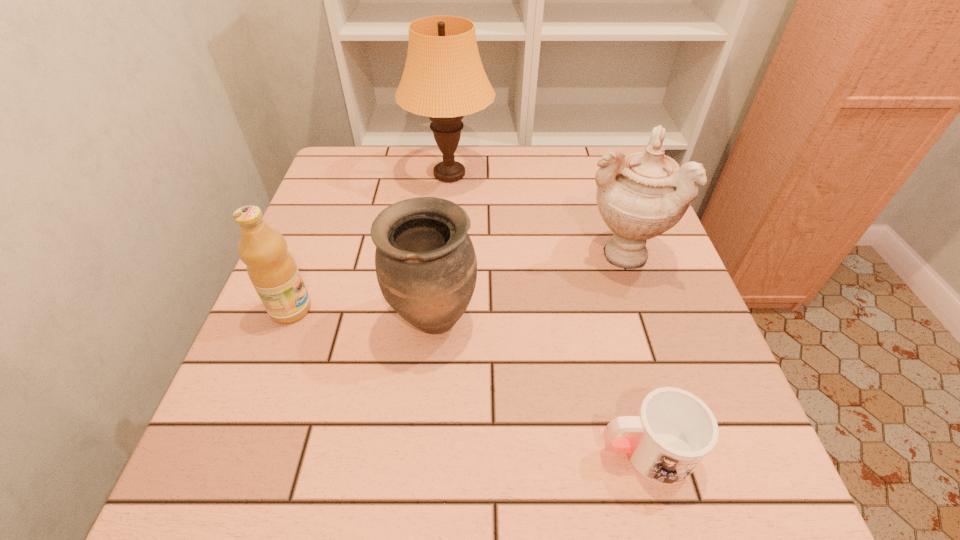
In order to click on free space between the right urn and the nearer urn in this screenshot , I will do click(x=526, y=287).

Locate an element on the screen. The height and width of the screenshot is (540, 960). vacant area that lies between the farther urn and the shortest object is located at coordinates (633, 352).

The width and height of the screenshot is (960, 540). I want to click on vacant point located between the shortest object and the farther urn, so click(633, 352).

Locate an element on the screen. Image resolution: width=960 pixels, height=540 pixels. unoccupied area between the olive oil and the nearest object is located at coordinates (468, 380).

Identify the location of free space between the leftmost object and the lampshade. The image size is (960, 540). (371, 242).

At what (x,y) coordinates should I click in order to perform the action: click on free spot between the olive oil and the mug. Please return your answer as a coordinate pair (x, y). The height and width of the screenshot is (540, 960). Looking at the image, I should click on (x=468, y=380).

This screenshot has height=540, width=960. I want to click on vacant area between the nearest object and the lampshade, so click(x=547, y=313).

Select which object appears as the second closest to the nearer urn. Please provide its 2D coordinates. Your answer should be formatted as a tuple, i.e. [(x, y)], where the tuple contains the x and y coordinates of a point satisfying the conditions above.

[(641, 195)]

Choose which object is the third nearest neighbor to the second farthest object. Please provide its 2D coordinates. Your answer should be formatted as a tuple, i.e. [(x, y)], where the tuple contains the x and y coordinates of a point satisfying the conditions above.

[(673, 431)]